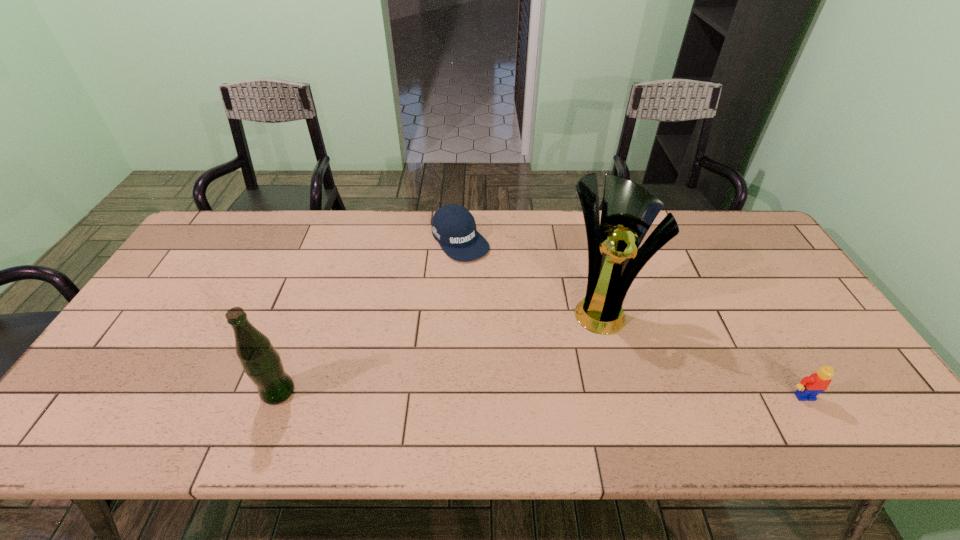
Where is `the leftmost object`? the leftmost object is located at coordinates (261, 362).

The height and width of the screenshot is (540, 960). What are the coordinates of `beer bottle` in the screenshot? It's located at [261, 362].

This screenshot has width=960, height=540. I want to click on Lego, so click(811, 386).

Locate an element on the screen. Image resolution: width=960 pixels, height=540 pixels. award is located at coordinates (628, 210).

Identify the location of the third object from left to right. (628, 210).

Where is `the farthest object`? The image size is (960, 540). the farthest object is located at coordinates (453, 226).

The height and width of the screenshot is (540, 960). What are the coordinates of `baseball cap` in the screenshot? It's located at (453, 226).

Where is `vacant space situated on the back of the leftmost object`? vacant space situated on the back of the leftmost object is located at coordinates (290, 361).

Identify the location of free space located 0.210m at the front of the tallest object, where the globe is visible. This screenshot has width=960, height=540. (582, 401).

You are a GUI agent. You are given a task and a screenshot of the screen. Output one action in this format:
    pyautogui.click(x=<x>, y=<y>)
    Task: Click on the vacant space located at the front of the tallest object, where the globe is visible
    Image resolution: width=960 pixels, height=540 pixels.
    Given the screenshot: What is the action you would take?
    pyautogui.click(x=583, y=398)